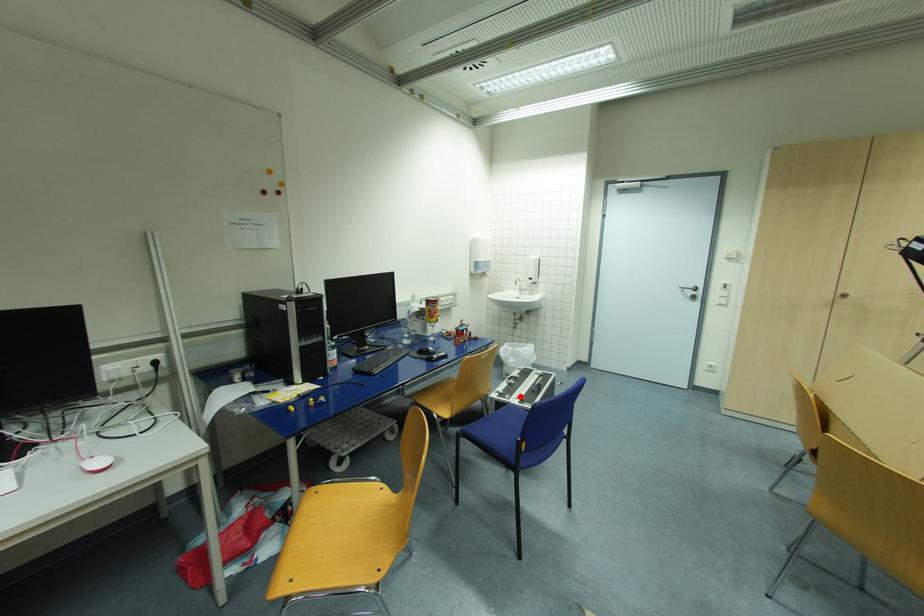
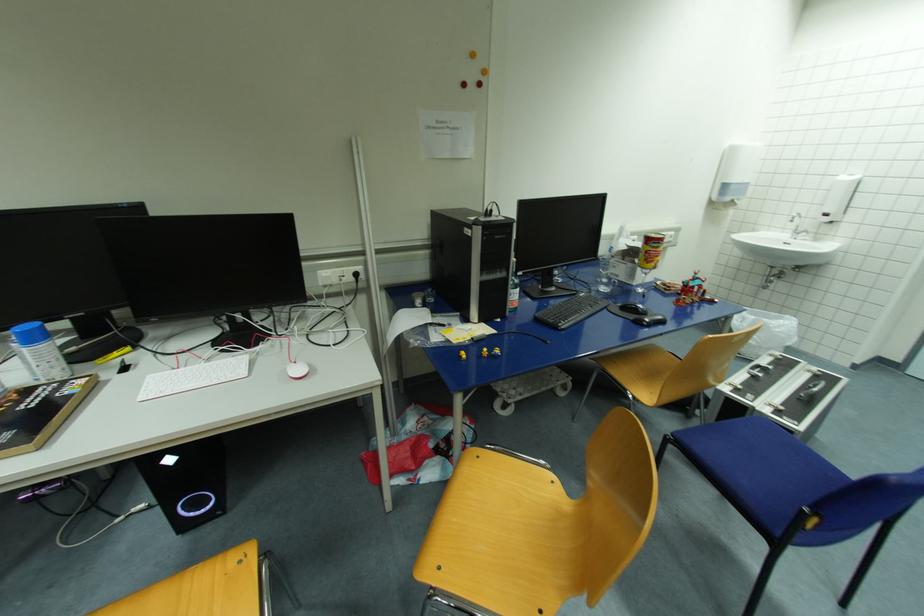
Where in the second image is the point corresponding to the highlighted location from the first image?

(772, 402)